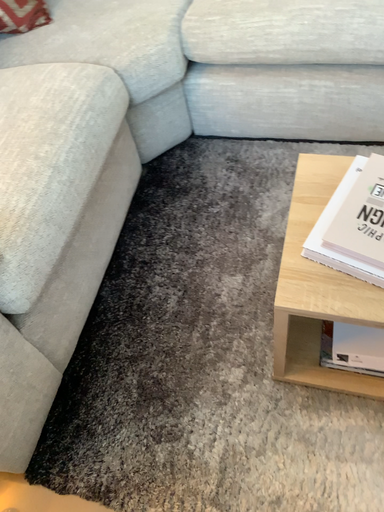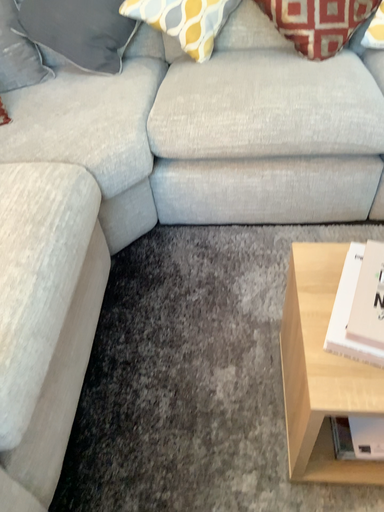
Question: How did the camera likely rotate when shooting the video?

Choices:
 (A) rotated right
 (B) rotated left

Answer: (A)